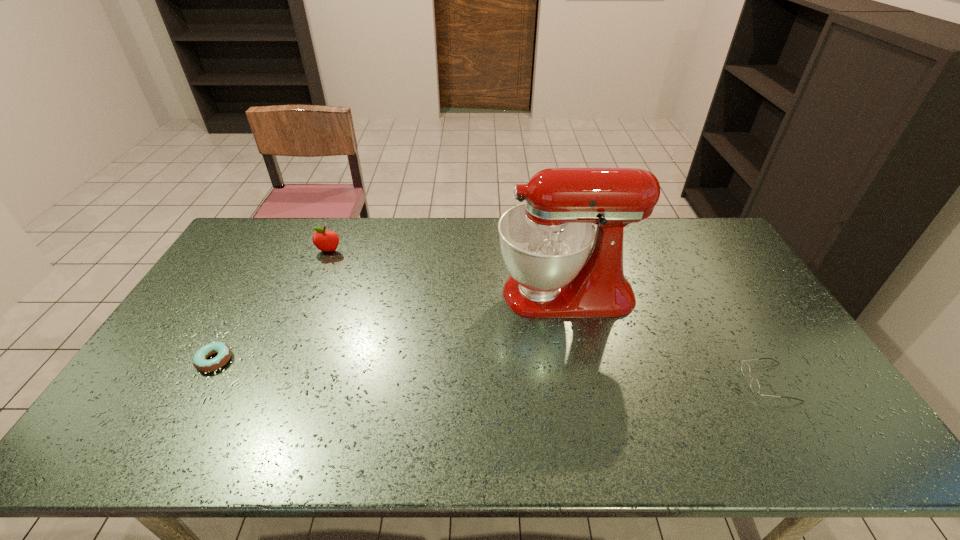
The height and width of the screenshot is (540, 960). I want to click on the second object from right to left, so click(545, 242).

In order to click on mixer in this screenshot , I will do `click(545, 242)`.

You are a GUI agent. You are given a task and a screenshot of the screen. Output one action in this format:
    pyautogui.click(x=<x>, y=<y>)
    Task: Click on the apple
    
    Given the screenshot: What is the action you would take?
    pyautogui.click(x=326, y=241)

The height and width of the screenshot is (540, 960). In order to click on the second tallest object in this screenshot , I will do `click(326, 241)`.

Locate an element on the screen. The width and height of the screenshot is (960, 540). the second shortest object is located at coordinates (754, 384).

You are a GUI agent. You are given a task and a screenshot of the screen. Output one action in this format:
    pyautogui.click(x=<x>, y=<y>)
    Task: Click on the spectacles
    
    Given the screenshot: What is the action you would take?
    pyautogui.click(x=754, y=384)

At what (x,y) coordinates should I click in order to perform the action: click on the leftmost object. Please return your answer as a coordinate pair (x, y). Looking at the image, I should click on (223, 350).

The width and height of the screenshot is (960, 540). I want to click on the shortest object, so click(x=223, y=350).

Image resolution: width=960 pixels, height=540 pixels. Identify the location of free location located 0.090m at the attachment hub of the mixer. (468, 293).

This screenshot has height=540, width=960. Identify the location of free spot located 0.090m at the attachment hub of the mixer. (468, 293).